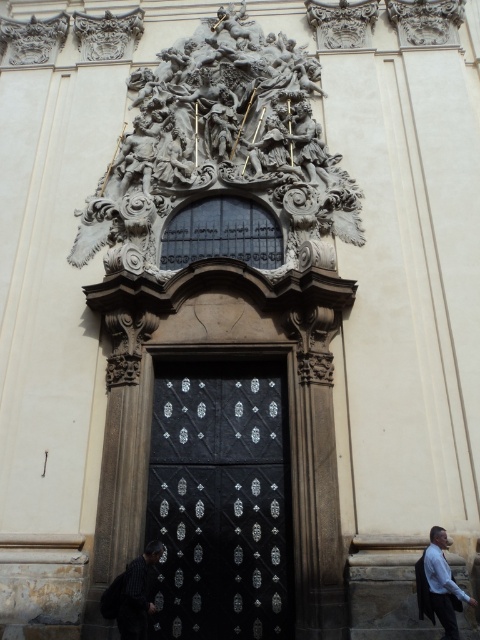
Based on the photo, you are a visitor standing at the entrance of the grand building and notice both the polished stone sculpture at upper center and the light blue shirt at lower right. Which object is positioned higher in the scene?

The polished stone sculpture at upper center is located above the light blue shirt at lower right, so it is positioned higher in the scene.

You are standing at the entrance of the grand building and want to take a photo. There are two points marked on the door, one at coordinate point (192, 152) and the other at point (166, 556). Which point will appear closer to the camera in your photo?

Point (192, 152) is further to the camera than point (166, 556), so in the photo, point (192, 152) will appear closer to the camera than point (166, 556).

You are a painter standing at the entrance of the grand building. You need to decide which object, the black textured metal door at center or the light blue shirt at lower right, requires more vertical space to paint a realistic representation. Which one should you focus on first?

The black textured metal door at center is much taller than the light blue shirt at lower right, so you should focus on painting the black textured metal door at center first to ensure it has enough vertical space.